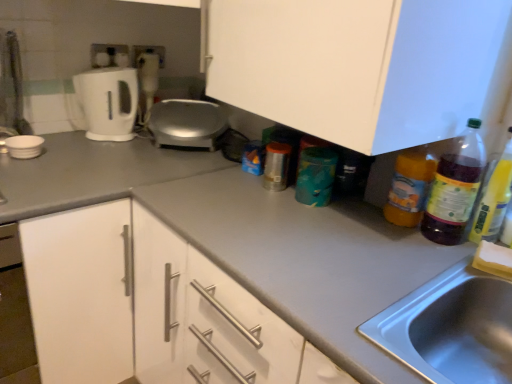
At what (x,y) coordinates should I click in order to perform the action: click on empty space that is in between satin silver appliance at center, placed as the second appliance when sorted from front to back, and white glossy electric kettle at upper left. Please return your answer as a coordinate pair (x, y). Looking at the image, I should click on (122, 141).